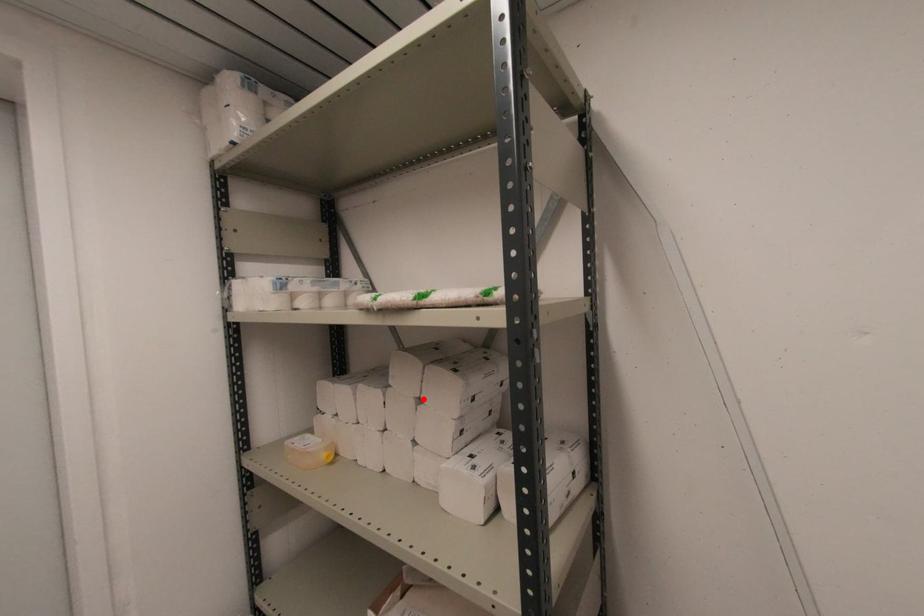
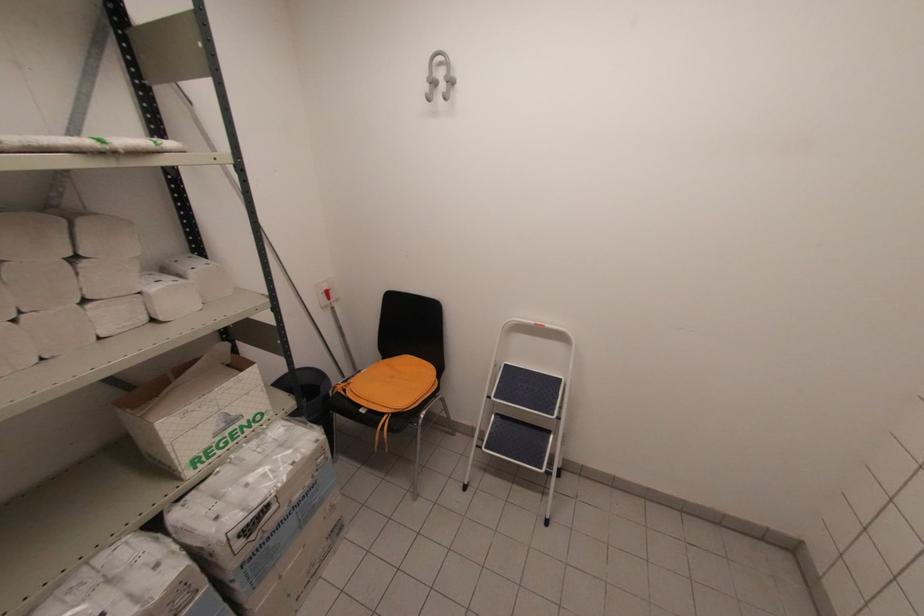
The point at the highlighted location is marked in the first image. Where is the corresponding point in the second image?

(81, 254)